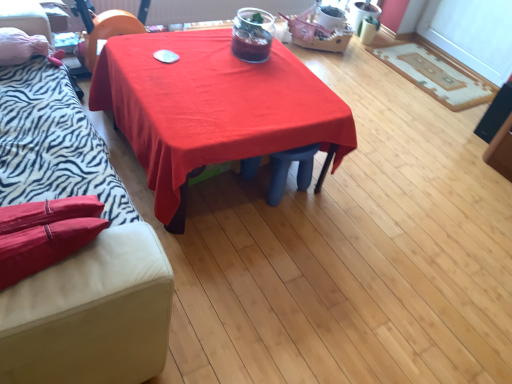
The image size is (512, 384). What do you see at coordinates (435, 75) in the screenshot? I see `beige textured rug at right` at bounding box center [435, 75].

The image size is (512, 384). In order to click on beige textured rug at right in this screenshot , I will do `click(435, 75)`.

Locate an element on the screen. The image size is (512, 384). table in front of the beige textured rug at right is located at coordinates (212, 108).

Between red fabric table at center and beige textured rug at right, which one is positioned in front?

red fabric table at center is closer to the camera.

Does red fabric table at center contain beige textured rug at right?

No, beige textured rug at right is not a part of red fabric table at center.

Considering the points (186, 35) and (482, 90), which point is in front, point (186, 35) or point (482, 90)?

Positioned in front is point (186, 35).

From the image's perspective, which one is positioned lower, beige textured rug at right or zebra print fabric couch at left?

zebra print fabric couch at left.

Does beige textured rug at right appear on the left side of zebra print fabric couch at left?

No, beige textured rug at right is not to the left of zebra print fabric couch at left.

Does point (421, 75) come behind point (25, 178)?

Yes, it is behind point (25, 178).

The height and width of the screenshot is (384, 512). I want to click on mat that is behind the zebra print fabric couch at left, so tap(435, 75).

Looking at their sizes, would you say red fabric table at center is wider or thinner than zebra print fabric couch at left?

Considering their sizes, red fabric table at center looks broader than zebra print fabric couch at left.

From the picture: From a real-world perspective, is red fabric table at center on top of zebra print fabric couch at left?

Incorrect, from a real-world perspective, red fabric table at center is lower than zebra print fabric couch at left.

Choose the correct answer: Is red fabric table at center inside zebra print fabric couch at left or outside it?

red fabric table at center lies outside zebra print fabric couch at left.

Is the position of zebra print fabric couch at left more distant than that of red fabric table at center?

No, the depth of zebra print fabric couch at left is less than that of red fabric table at center.

Between zebra print fabric couch at left and red fabric table at center, which one has more height?

With more height is zebra print fabric couch at left.

Measure the distance from zebra print fabric couch at left to red fabric table at center.

19.19 inches.

This screenshot has width=512, height=384. Identify the location of studio couch that appears above the red fabric table at center (from a real-world perspective). (73, 247).

From the image's perspective, is beige textured rug at right above or below red fabric table at center?

beige textured rug at right is situated higher than red fabric table at center in the image.

From the picture: Looking at their sizes, would you say beige textured rug at right is wider or thinner than red fabric table at center?

In the image, beige textured rug at right appears to be more narrow than red fabric table at center.

Does beige textured rug at right have a smaller size compared to red fabric table at center?

Correct, beige textured rug at right occupies less space than red fabric table at center.

From a real-world perspective, is beige textured rug at right physically above red fabric table at center?

No, from a real-world perspective, beige textured rug at right is not above red fabric table at center.

Does zebra print fabric couch at left touch beige textured rug at right?

No, zebra print fabric couch at left is not next to beige textured rug at right.

Which is in front, point (49, 141) or point (464, 96)?

The point (49, 141) is more forward.

At what (x,y) coordinates should I click in order to perform the action: click on mat that appears below the red fabric table at center (from a real-world perspective). Please return your answer as a coordinate pair (x, y). The width and height of the screenshot is (512, 384). Looking at the image, I should click on (435, 75).

This screenshot has width=512, height=384. What are the coordinates of `mat above the zebra print fabric couch at left (from the image's perspective)` in the screenshot? It's located at (435, 75).

Based on their spatial positions, is red fabric table at center or beige textured rug at right closer to zebra print fabric couch at left?

Based on the image, red fabric table at center appears to be nearer to zebra print fabric couch at left.

Looking at the image, which one is located closer to zebra print fabric couch at left, beige textured rug at right or red fabric table at center?

The object closer to zebra print fabric couch at left is red fabric table at center.

Considering their positions, is red fabric table at center positioned closer to beige textured rug at right than zebra print fabric couch at left?

Among the two, red fabric table at center is located nearer to beige textured rug at right.

Considering their positions, is beige textured rug at right positioned further to red fabric table at center than zebra print fabric couch at left?

Among the two, beige textured rug at right is located further to red fabric table at center.

When comparing their distances from beige textured rug at right, does zebra print fabric couch at left or red fabric table at center seem further?

zebra print fabric couch at left is further to beige textured rug at right.

In the scene shown: From the image, which object appears to be farther from red fabric table at center, zebra print fabric couch at left or beige textured rug at right?

The object further to red fabric table at center is beige textured rug at right.

Locate an element on the screen. The width and height of the screenshot is (512, 384). table between zebra print fabric couch at left and beige textured rug at right in the front-back direction is located at coordinates (212, 108).